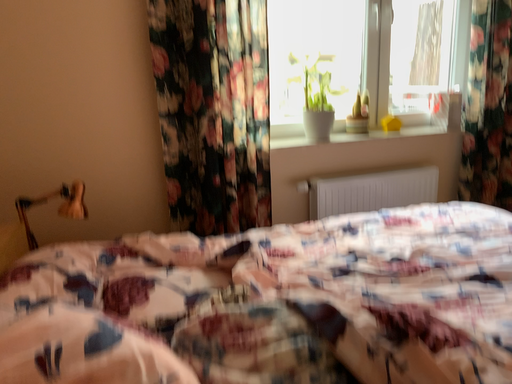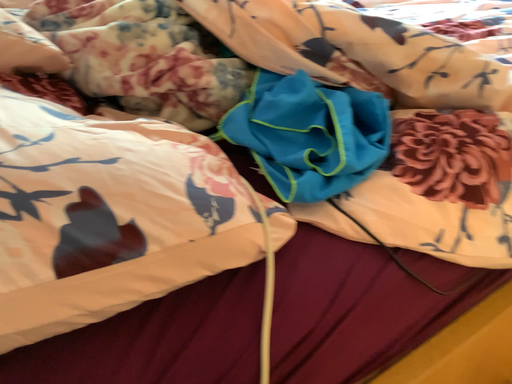
Question: How did the camera likely rotate when shooting the video?

Choices:
 (A) rotated left
 (B) rotated right

Answer: (B)